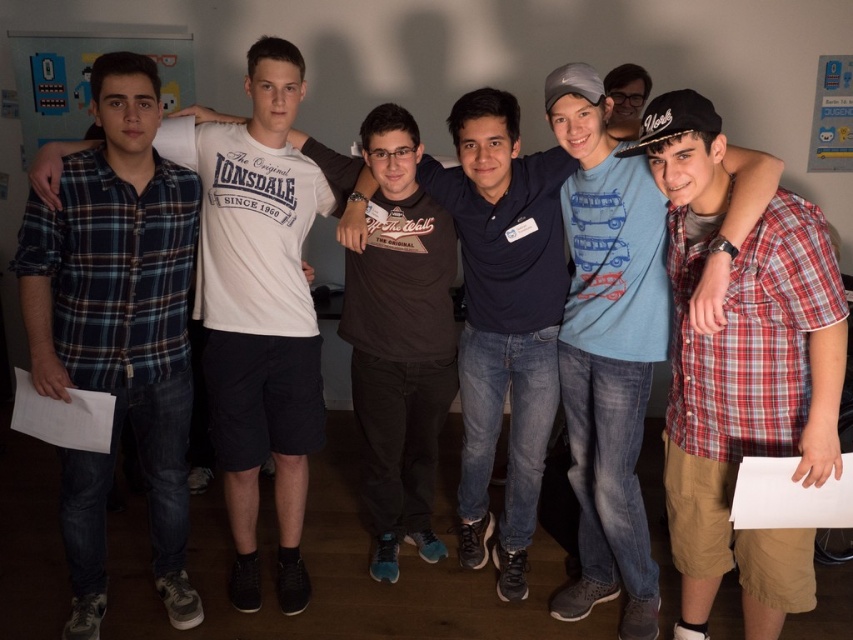
Question: Based on their relative distances, which object is nearer to the plaid cotton shirt at right?

Choices:
 (A) plaid flannel shirt at left
 (B) brushed metal bulletin board at upper left
 (C) brown cotton t-shirt at center

Answer: (C)

Question: Is brown cotton t-shirt at center to the left of brushed metal bulletin board at upper left from the viewer's perspective?

Choices:
 (A) yes
 (B) no

Answer: (B)

Question: Among these objects, which one is nearest to the camera?

Choices:
 (A) brushed metal bulletin board at upper left
 (B) plaid cotton shirt at right
 (C) plaid flannel shirt at left

Answer: (B)

Question: Which object is positioned farthest from the plaid flannel shirt at left?

Choices:
 (A) plaid cotton shirt at right
 (B) brushed metal bulletin board at upper left

Answer: (B)

Question: Is plaid cotton shirt at right to the right of plaid flannel shirt at left from the viewer's perspective?

Choices:
 (A) yes
 (B) no

Answer: (A)

Question: Does plaid cotton shirt at right lie behind brown cotton t-shirt at center?

Choices:
 (A) yes
 (B) no

Answer: (B)